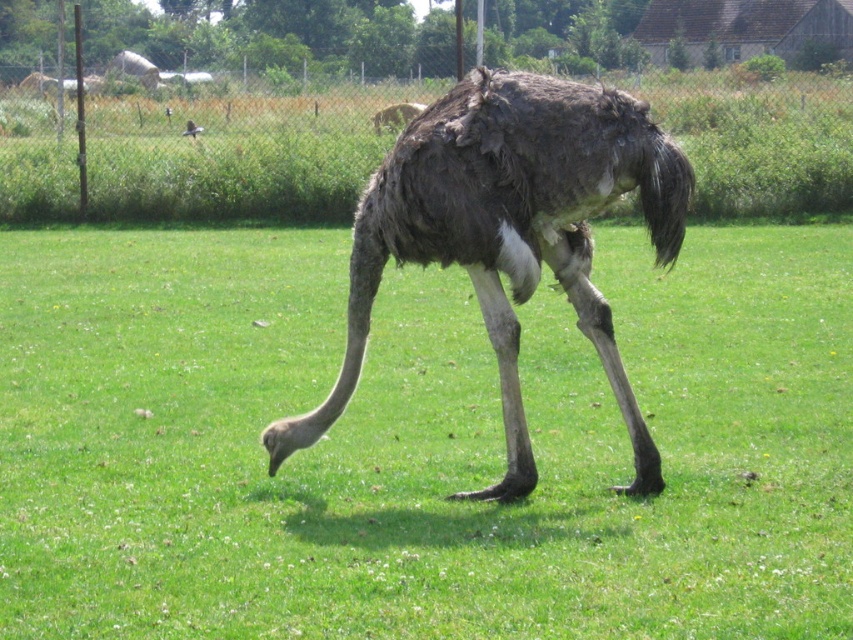
You are standing at the origin point in the image. The ostrich is to your right. Where is the green grass at center located relative to your position?

The green grass at center is located at coordinates 0.694 in the x direction and 0.491 in the y direction relative to the origin point.

You are a photographer trying to capture the brown feathered ostrich at center and the shiny black bird at upper left in the same frame. Based on their positions, which one will appear closer to the camera in your photo?

The brown feathered ostrich at center will appear closer to the camera because it is positioned in front of the shiny black bird at upper left.